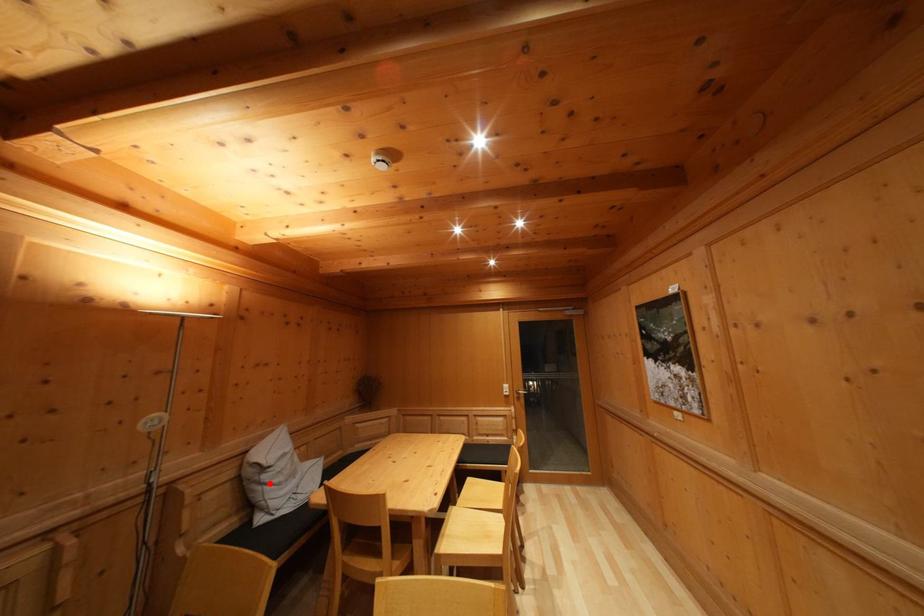
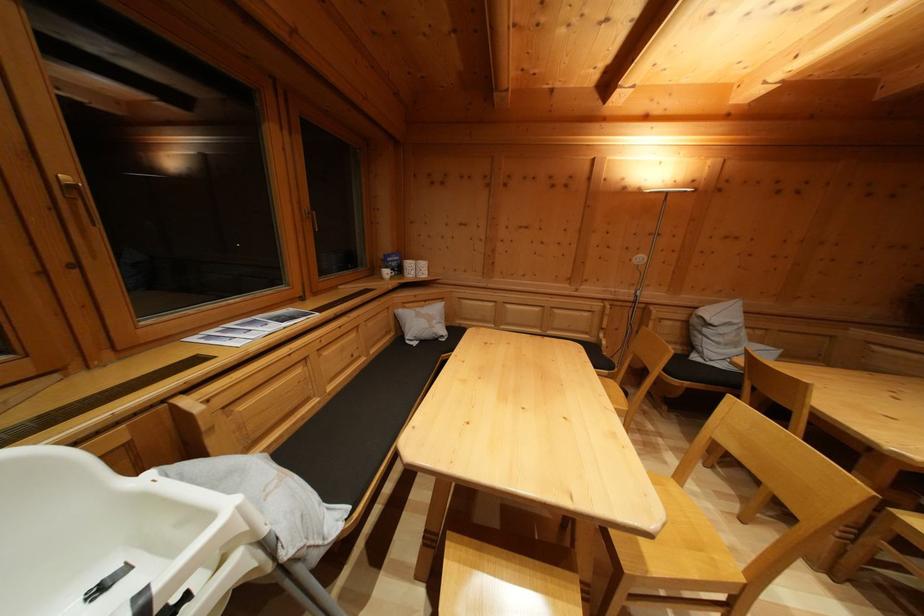
Where in the second image is the point corresponding to the highlighted location from the first image?

(711, 337)